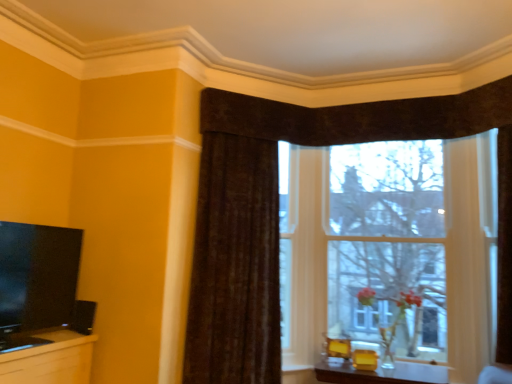
Question: Considering the relative sizes of matte black tv at left and brown textured curtain at upper center in the image provided, is matte black tv at left thinner than brown textured curtain at upper center?

Choices:
 (A) yes
 (B) no

Answer: (A)

Question: Can you confirm if matte black tv at left is smaller than brown textured curtain at upper center?

Choices:
 (A) yes
 (B) no

Answer: (A)

Question: Considering the relative sizes of matte black tv at left and brown textured curtain at upper center in the image provided, is matte black tv at left shorter than brown textured curtain at upper center?

Choices:
 (A) yes
 (B) no

Answer: (A)

Question: Can you confirm if matte black tv at left is positioned to the right of brown textured curtain at upper center?

Choices:
 (A) yes
 (B) no

Answer: (B)

Question: From the image's perspective, is matte black tv at left located beneath brown textured curtain at upper center?

Choices:
 (A) yes
 (B) no

Answer: (A)

Question: Would you say matte black tv at left is outside brown textured curtain at upper center?

Choices:
 (A) no
 (B) yes

Answer: (B)

Question: Is transparent glass window at center to the left of brown textured curtain at upper center from the viewer's perspective?

Choices:
 (A) no
 (B) yes

Answer: (A)

Question: From a real-world perspective, is transparent glass window at center beneath brown textured curtain at upper center?

Choices:
 (A) no
 (B) yes

Answer: (A)

Question: From a real-world perspective, does transparent glass window at center stand above brown textured curtain at upper center?

Choices:
 (A) yes
 (B) no

Answer: (A)

Question: Is transparent glass window at center placed right next to brown textured curtain at upper center?

Choices:
 (A) yes
 (B) no

Answer: (B)

Question: Is transparent glass window at center not within brown textured curtain at upper center?

Choices:
 (A) yes
 (B) no

Answer: (A)

Question: Is transparent glass window at center thinner than brown textured curtain at upper center?

Choices:
 (A) no
 (B) yes

Answer: (A)

Question: Can you confirm if matte yellow table at lower center is thinner than transparent glass window at center?

Choices:
 (A) no
 (B) yes

Answer: (A)